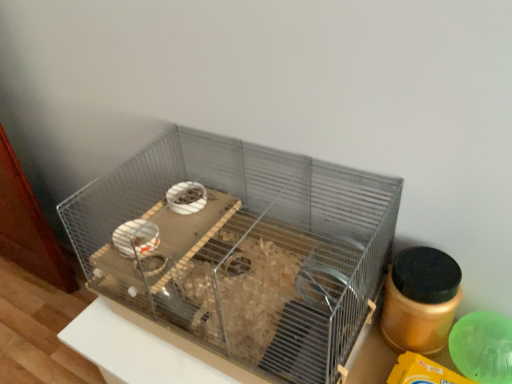
Describe the element at coordinates (243, 250) in the screenshot. This screenshot has height=384, width=512. I see `metal wire bird cage at center` at that location.

Locate an element on the screen. metal wire bird cage at center is located at coordinates (243, 250).

What is the approximate height of gold matte jar at right?

gold matte jar at right is 17.50 centimeters tall.

At what (x,y) coordinates should I click in order to perform the action: click on gold matte jar at right. Please return your answer as a coordinate pair (x, y). This screenshot has height=384, width=512. Looking at the image, I should click on (420, 300).

Image resolution: width=512 pixels, height=384 pixels. What do you see at coordinates (420, 300) in the screenshot? I see `gold matte jar at right` at bounding box center [420, 300].

The width and height of the screenshot is (512, 384). I want to click on metal wire bird cage at center, so click(x=243, y=250).

Which is more to the right, gold matte jar at right or metal wire bird cage at center?

Positioned to the right is gold matte jar at right.

Which object is more forward, gold matte jar at right or metal wire bird cage at center?

metal wire bird cage at center is in front.

Which is behind, point (429, 333) or point (156, 257)?

The point (156, 257) is farther.

From the image's perspective, which one is positioned lower, gold matte jar at right or metal wire bird cage at center?

gold matte jar at right.

From a real-world perspective, between gold matte jar at right and metal wire bird cage at center, who is vertically higher?

metal wire bird cage at center.

Is gold matte jar at right thinner than metal wire bird cage at center?

Yes.

Who is shorter, gold matte jar at right or metal wire bird cage at center?

gold matte jar at right is shorter.

Between gold matte jar at right and metal wire bird cage at center, which one has larger size?

Bigger between the two is metal wire bird cage at center.

Would you say metal wire bird cage at center is part of gold matte jar at right's contents?

No, metal wire bird cage at center is not a part of gold matte jar at right.

Is gold matte jar at right far away from metal wire bird cage at center?

gold matte jar at right is actually quite close to metal wire bird cage at center.

Is gold matte jar at right facing towards metal wire bird cage at center?

No, gold matte jar at right is not aimed at metal wire bird cage at center.

This screenshot has height=384, width=512. In order to click on bottle on the right of metal wire bird cage at center in this screenshot , I will do `click(420, 300)`.

Based on their positions, is metal wire bird cage at center located to the left or right of gold matte jar at right?

Clearly, metal wire bird cage at center is on the left of gold matte jar at right in the image.

Considering the positions of objects metal wire bird cage at center and gold matte jar at right in the image provided, who is behind, metal wire bird cage at center or gold matte jar at right?

gold matte jar at right.

Which is less distant, (239, 243) or (436, 321)?

Point (239, 243) is farther from the camera than point (436, 321).

From the image's perspective, which one is positioned lower, metal wire bird cage at center or gold matte jar at right?

gold matte jar at right is shown below in the image.

From a real-world perspective, is metal wire bird cage at center positioned above or below gold matte jar at right?

metal wire bird cage at center is situated higher than gold matte jar at right in the real world.

Is metal wire bird cage at center wider or thinner than gold matte jar at right?

In the image, metal wire bird cage at center appears to be wider than gold matte jar at right.

Between metal wire bird cage at center and gold matte jar at right, which one has more height?

Standing taller between the two is metal wire bird cage at center.

Considering the sizes of objects metal wire bird cage at center and gold matte jar at right in the image provided, who is bigger, metal wire bird cage at center or gold matte jar at right?

With larger size is metal wire bird cage at center.

Is metal wire bird cage at center situated inside gold matte jar at right or outside?

metal wire bird cage at center is located beyond the bounds of gold matte jar at right.

Is metal wire bird cage at center positioned far away from gold matte jar at right?

They are positioned close to each other.

Is metal wire bird cage at center positioned with its back to gold matte jar at right?

No, metal wire bird cage at center is not facing the opposite direction of gold matte jar at right.

How different are the orientations of metal wire bird cage at center and gold matte jar at right in degrees?

The facing directions of metal wire bird cage at center and gold matte jar at right are 1.4e-05 degrees apart.

I want to click on bottle behind the metal wire bird cage at center, so click(420, 300).

This screenshot has height=384, width=512. Identify the location of bottle below the metal wire bird cage at center (from a real-world perspective). (420, 300).

This screenshot has height=384, width=512. I want to click on bottle on the right of metal wire bird cage at center, so click(x=420, y=300).